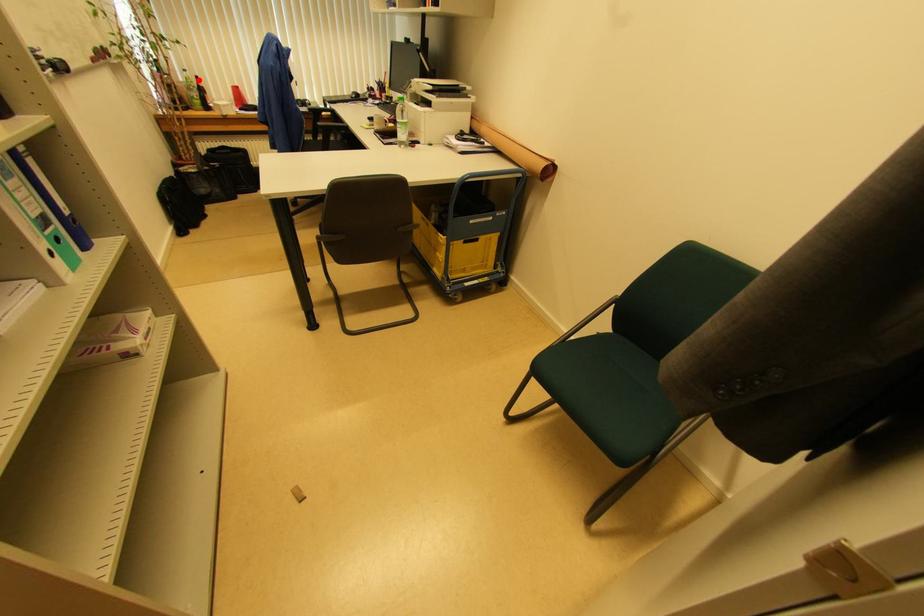
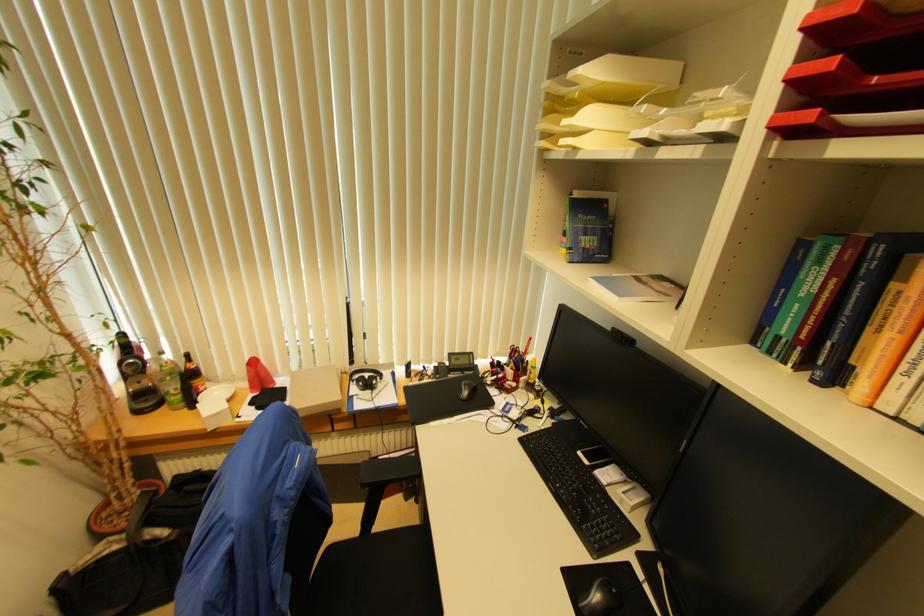
Question: I am providing you with two images of the same scene from different viewpoints. In image1, a red point is highlighted. Considering the same 3D point in image2, which of the following is correct?

Choices:
 (A) It is closer
 (B) It is farther

Answer: (A)